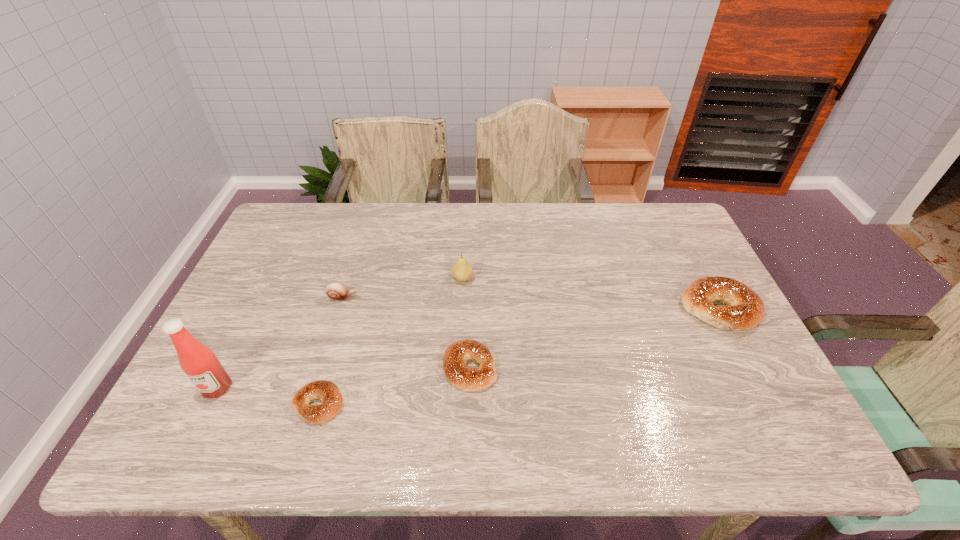
Where is `the shortest object`? The height and width of the screenshot is (540, 960). the shortest object is located at coordinates (328, 393).

Locate an element on the screen. the leftmost bagel is located at coordinates (328, 393).

What are the coordinates of `the second bagel from left to right` in the screenshot? It's located at (457, 372).

Locate an element on the screen. Image resolution: width=960 pixels, height=540 pixels. the fifth tallest object is located at coordinates (457, 372).

Locate an element on the screen. the tallest bagel is located at coordinates (745, 309).

Identify the location of the rightmost object. The height and width of the screenshot is (540, 960). (745, 309).

Where is `the leftmost object`? This screenshot has width=960, height=540. the leftmost object is located at coordinates (200, 364).

This screenshot has height=540, width=960. In order to click on the tallest object in this screenshot , I will do `click(200, 364)`.

The height and width of the screenshot is (540, 960). Identify the location of escargot. (335, 291).

At what (x,y) coordinates should I click in order to perform the action: click on the fifth shortest object. Please return your answer as a coordinate pair (x, y). The image size is (960, 540). Looking at the image, I should click on (462, 271).